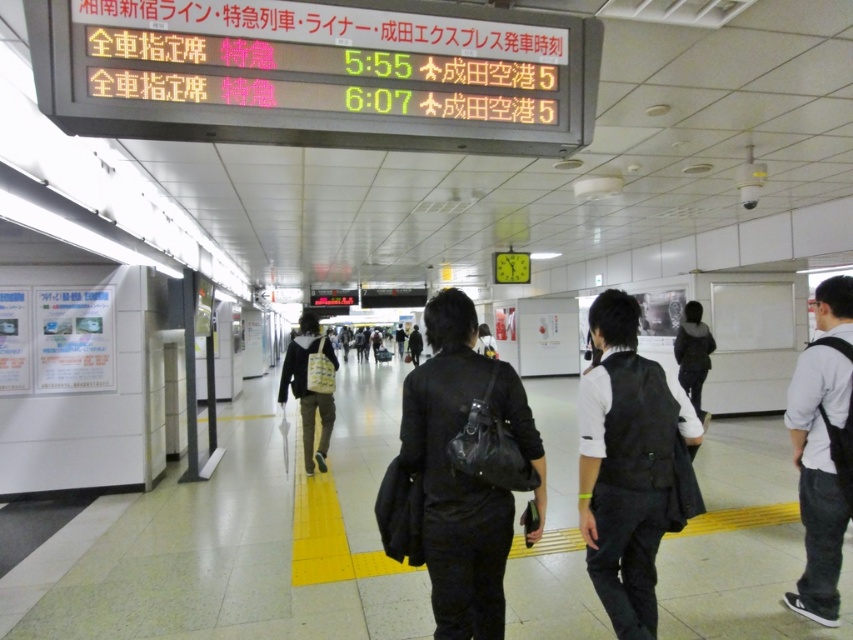
You are a commuter on the platform and need to pick up your luggage. You see the black matte bag at center and the white fabric bag at center. Which one is taller?

The black matte bag at center is taller than the white fabric bag at center.

You are a commuter standing at the entrance of the train station platform. You notice a black matte bag at center lying on the ground. If you walk straight ahead towards the platform, will the bag be in your path?

The black matte bag at center is located at point (457, 476), which is directly in front of you. Therefore, walking straight ahead towards the platform will place you directly on the path leading to the bag, so yes, it will be in your path.

You are standing on the platform at the train station and want to reach the point marked at coordinate point [666,464]. If you walk straight ahead, how far will you have to walk to reach that point?

The point at coordinate point [666,464] is 8.72 feet away from the viewer, so you will have to walk 8.72 feet straight ahead to reach it.